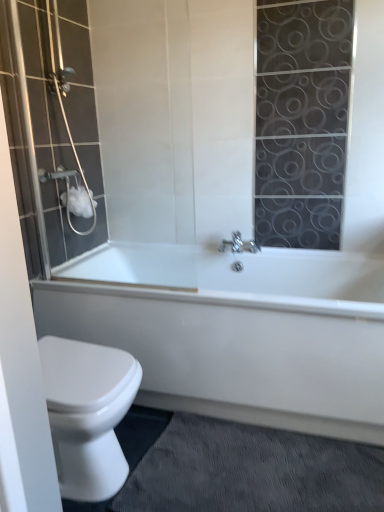
Question: From the image's perspective, is white glossy bathtub at lower center located above or below matte glass shower door at left?

Choices:
 (A) below
 (B) above

Answer: (A)

Question: Considering the positions of white glossy bathtub at lower center and matte glass shower door at left in the image, is white glossy bathtub at lower center bigger or smaller than matte glass shower door at left?

Choices:
 (A) small
 (B) big

Answer: (B)

Question: Estimate the real-world distances between objects in this image. Which object is closer to the white glossy bathtub at lower center?

Choices:
 (A) gray textured bath mat at lower right
 (B) matte glass shower door at left
 (C) white matte toilet paper at upper left

Answer: (A)

Question: Estimate the real-world distances between objects in this image. Which object is closer to the white matte toilet paper at upper left?

Choices:
 (A) matte glass shower door at left
 (B) white glossy bathtub at lower center
 (C) gray textured bath mat at lower right

Answer: (A)